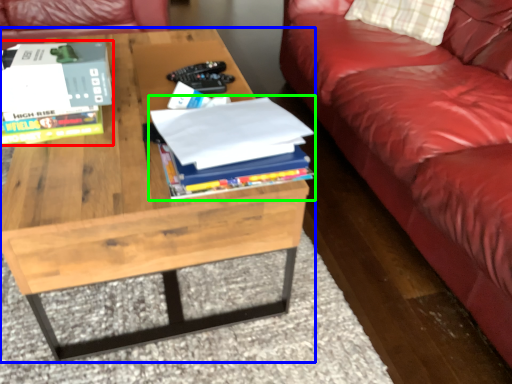
Question: Estimate the real-world distances between objects in this image. Which object is farther from book (highlighted by a red box), coffee table (highlighted by a blue box) or book (highlighted by a green box)?

Choices:
 (A) coffee table
 (B) book

Answer: (B)